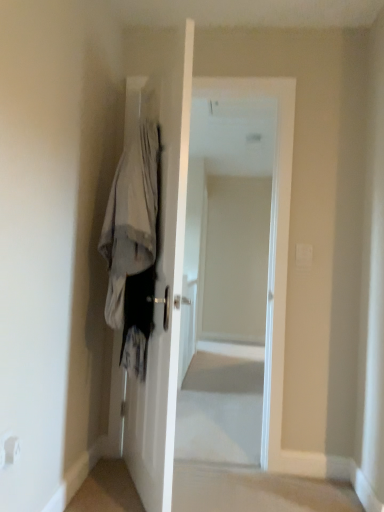
Question: From their relative heights in the image, would you say white fabric coat at left is taller or shorter than white glossy door at center?

Choices:
 (A) short
 (B) tall

Answer: (A)

Question: Is white fabric coat at left inside the boundaries of white glossy door at center, or outside?

Choices:
 (A) outside
 (B) inside

Answer: (A)

Question: Which object is the closest to the white fabric coat at left?

Choices:
 (A) white glossy door at center
 (B) white glossy door at center

Answer: (A)

Question: Which is farther from the white fabric coat at left?

Choices:
 (A) white glossy door at center
 (B) white glossy door at center

Answer: (B)